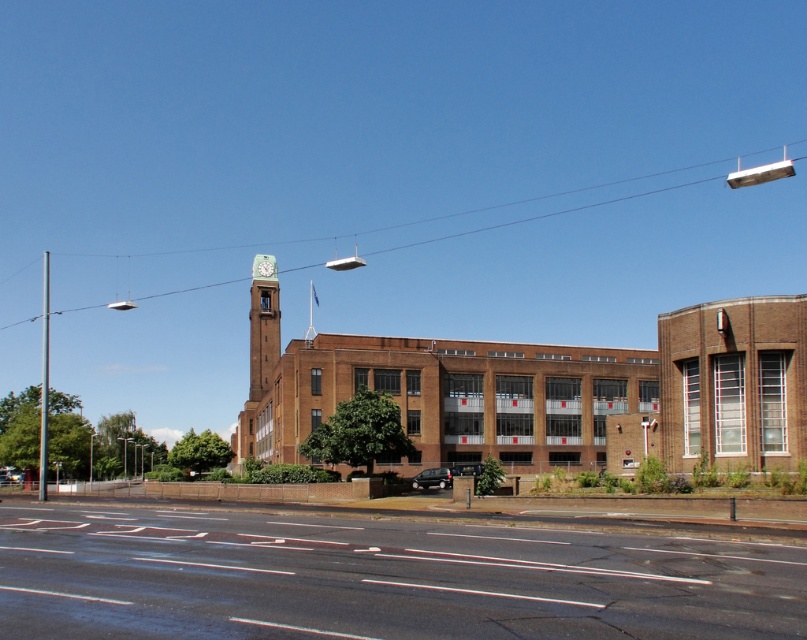
Between black asphalt road at lower center and green painted brick clock tower at upper center, which one has less height?

With less height is black asphalt road at lower center.

Is black asphalt road at lower center shorter than green painted brick clock tower at upper center?

Correct, black asphalt road at lower center is not as tall as green painted brick clock tower at upper center.

I want to click on black asphalt road at lower center, so click(378, 579).

Is green painted brick clock tower at upper center taller than matte red clock at center?

Correct, green painted brick clock tower at upper center is much taller as matte red clock at center.

Between green painted brick clock tower at upper center and matte red clock at center, which one appears on the right side from the viewer's perspective?

Positioned to the right is matte red clock at center.

Based on the photo, who is more distant from viewer, (260, 348) or (266, 269)?

The point (266, 269) is behind.

Where is `green painted brick clock tower at upper center`? The width and height of the screenshot is (807, 640). green painted brick clock tower at upper center is located at coordinates pyautogui.click(x=262, y=324).

Is point (256, 355) positioned after point (440, 484)?

Yes, point (256, 355) is behind point (440, 484).

What do you see at coordinates (262, 324) in the screenshot? This screenshot has height=640, width=807. I see `green painted brick clock tower at upper center` at bounding box center [262, 324].

This screenshot has width=807, height=640. In order to click on green painted brick clock tower at upper center in this screenshot , I will do `click(262, 324)`.

Locate an element on the screen. green painted brick clock tower at upper center is located at coordinates (262, 324).